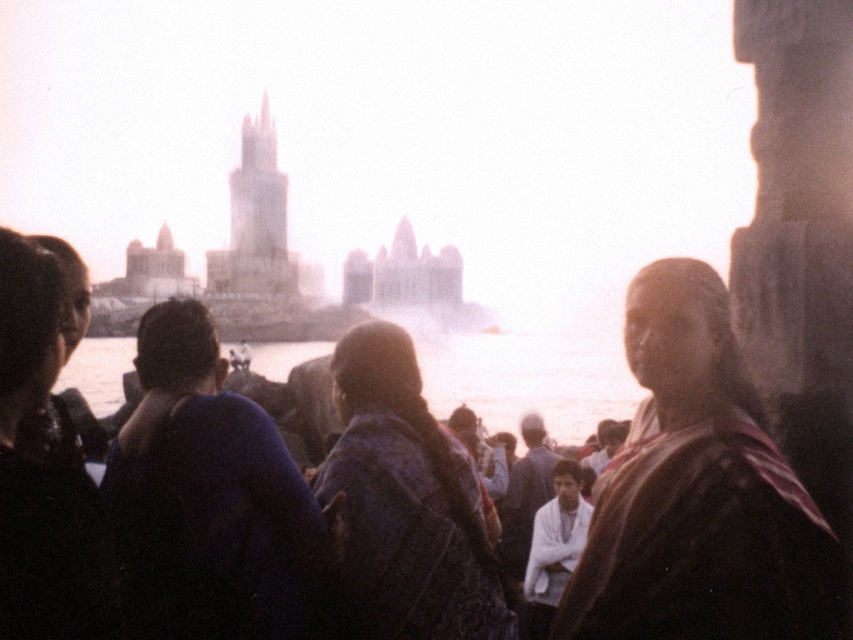
Which of these two, dark blue sweater at center or black fabric at left, stands taller?

black fabric at left is taller.

Which is behind, point (109, 502) or point (6, 291)?

Point (109, 502)

Who is more distant from viewer, (x=219, y=448) or (x=44, y=266)?

The point (x=219, y=448) is behind.

Identify the location of dark blue sweater at center. (210, 497).

Who is shorter, dark brown fabric at right or black fabric at left?

With less height is black fabric at left.

Identify the location of dark brown fabric at right. (698, 492).

Who is positioned more to the left, dark blue sweater at center or white cotton shirt at center?

Positioned to the left is dark blue sweater at center.

Can you confirm if dark blue sweater at center is thinner than white cotton shirt at center?

In fact, dark blue sweater at center might be wider than white cotton shirt at center.

The image size is (853, 640). Describe the element at coordinates (210, 497) in the screenshot. I see `dark blue sweater at center` at that location.

Find the location of `dark blue sweater at center`. dark blue sweater at center is located at coordinates (210, 497).